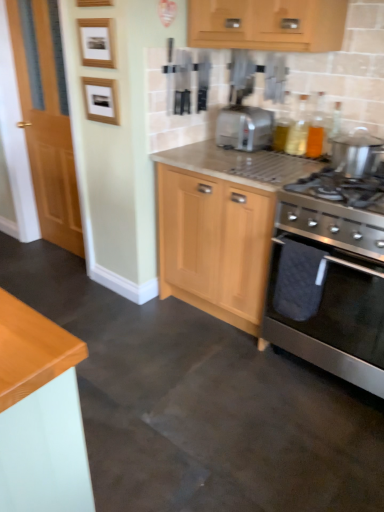
Question: From the image's perspective, is stainless steel gas stove at right on top of stainless steel oven at lower right?

Choices:
 (A) yes
 (B) no

Answer: (A)

Question: Can you confirm if stainless steel gas stove at right is bigger than stainless steel oven at lower right?

Choices:
 (A) no
 (B) yes

Answer: (A)

Question: Can you confirm if stainless steel gas stove at right is positioned to the right of stainless steel oven at lower right?

Choices:
 (A) yes
 (B) no

Answer: (B)

Question: Is stainless steel gas stove at right further to camera compared to stainless steel oven at lower right?

Choices:
 (A) yes
 (B) no

Answer: (A)

Question: Considering the relative positions of stainless steel gas stove at right and stainless steel oven at lower right in the image provided, is stainless steel gas stove at right to the left of stainless steel oven at lower right from the viewer's perspective?

Choices:
 (A) yes
 (B) no

Answer: (A)

Question: From a real-world perspective, is wooden picture frame at upper left, the first picture frame from the bottom, positioned above or below stainless steel oven at lower right?

Choices:
 (A) above
 (B) below

Answer: (A)

Question: Based on their sizes in the image, would you say wooden picture frame at upper left, the first picture frame from the bottom, is bigger or smaller than stainless steel oven at lower right?

Choices:
 (A) small
 (B) big

Answer: (A)

Question: Based on their positions, is wooden picture frame at upper left, positioned as the second picture frame in top-to-bottom order, located to the left or right of stainless steel oven at lower right?

Choices:
 (A) right
 (B) left

Answer: (B)

Question: From their relative heights in the image, would you say wooden picture frame at upper left, the first picture frame from the bottom, is taller or shorter than stainless steel oven at lower right?

Choices:
 (A) tall
 (B) short

Answer: (B)

Question: Looking at the image, does translucent glass bottles at upper right, the first bottle from the right, seem bigger or smaller compared to stainless steel oven at lower right?

Choices:
 (A) big
 (B) small

Answer: (B)

Question: From the image's perspective, relative to stainless steel oven at lower right, is translucent glass bottles at upper right, the first bottle from the right, above or below?

Choices:
 (A) below
 (B) above

Answer: (B)

Question: In terms of width, does translucent glass bottles at upper right, arranged as the 2th bottle when viewed from the left, look wider or thinner when compared to stainless steel oven at lower right?

Choices:
 (A) wide
 (B) thin

Answer: (B)

Question: Considering the positions of point (314, 117) and point (301, 315), is point (314, 117) closer or farther from the camera than point (301, 315)?

Choices:
 (A) farther
 (B) closer

Answer: (A)

Question: In the image, is light wood cabinet at center on the left side or the right side of wooden picture frame at upper left, which ranks as the second picture frame in bottom-to-top order?

Choices:
 (A) left
 (B) right

Answer: (B)

Question: Relative to wooden picture frame at upper left, which ranks as the second picture frame in bottom-to-top order, is light wood cabinet at center in front or behind?

Choices:
 (A) front
 (B) behind

Answer: (A)